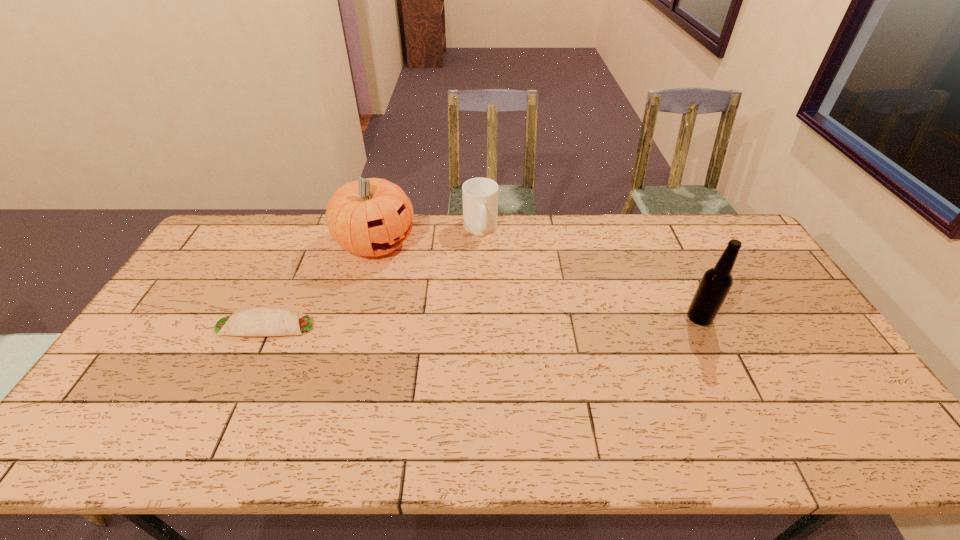
This screenshot has width=960, height=540. In order to click on blank space located on the handle side of the second shortest object in this screenshot , I will do `click(505, 284)`.

Where is `free space located on the handle side of the second shortest object`? The image size is (960, 540). free space located on the handle side of the second shortest object is located at coordinates pos(491,254).

Where is `vacant space located 0.380m on the handle side of the second shortest object`? The width and height of the screenshot is (960, 540). vacant space located 0.380m on the handle side of the second shortest object is located at coordinates (522, 320).

Where is `pumpkin at the far edge`? The image size is (960, 540). pumpkin at the far edge is located at coordinates (372, 217).

At what (x,y) coordinates should I click in order to perform the action: click on mug that is at the far edge. Please return your answer as a coordinate pair (x, y). The image size is (960, 540). Looking at the image, I should click on (480, 195).

Locate an element on the screen. vacant space at the far edge is located at coordinates (556, 228).

Locate an element on the screen. Image resolution: width=960 pixels, height=540 pixels. free spot at the near edge of the desktop is located at coordinates (765, 400).

The image size is (960, 540). Identify the location of vacant space at the left edge of the desktop. coord(221,302).

You are a GUI agent. You are given a task and a screenshot of the screen. Output one action in this format:
    pyautogui.click(x=<x>, y=<y>)
    Task: Click on the vacant space at the far left corner of the desktop
    Image resolution: width=960 pixels, height=540 pixels.
    Given the screenshot: What is the action you would take?
    click(237, 235)

Find the location of a particular element. vacant space that is in between the second object from right to left and the shortest object is located at coordinates (372, 277).